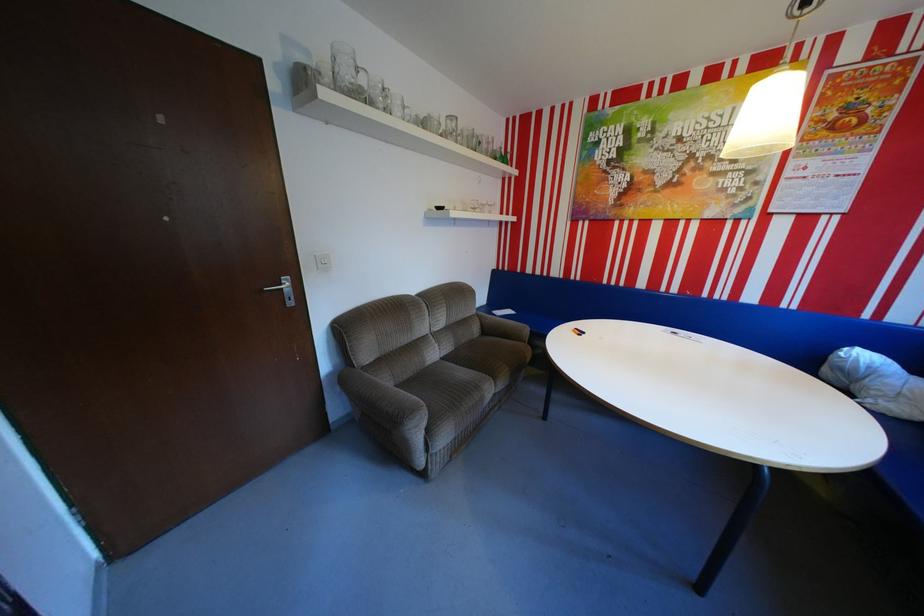
What do you see at coordinates (284, 290) in the screenshot? The height and width of the screenshot is (616, 924). I see `the metal door handle` at bounding box center [284, 290].